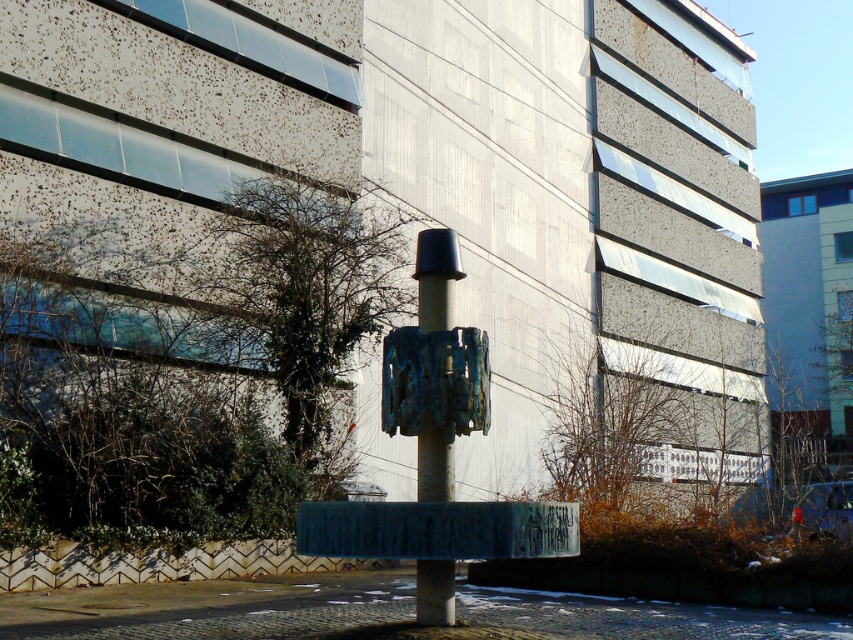
Between point (380, 531) and point (444, 600), which one is positioned in front?

Point (380, 531) is in front.

Does green painted concrete at center have a lesser width compared to bronze textured sculpture at center?

No.

Which is in front, point (302, 508) or point (416, 561)?

Positioned in front is point (302, 508).

This screenshot has width=853, height=640. In order to click on green painted concrete at center in this screenshot , I will do `click(438, 529)`.